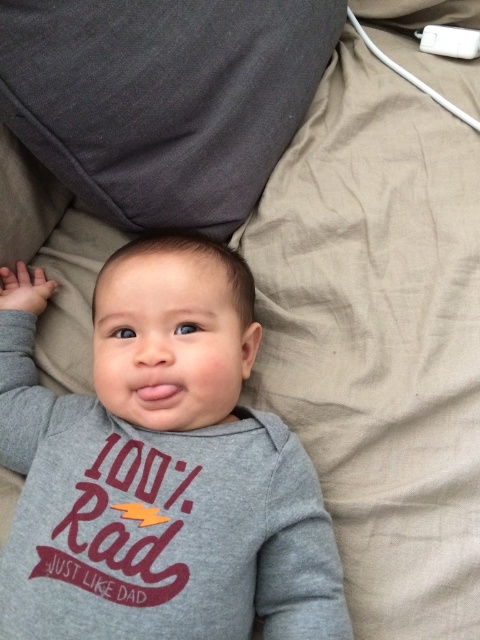
You are a parent trying to locate your baby monitor. The dark gray fabric pillow at upper center and the white plastic remote at upper right are in the scene. Which object is closer to the top of the image?

The white plastic remote at upper right is closer to the top of the image because the dark gray fabric pillow at upper center is below it.

You are a photographer setting up for a baby photo shoot. You have a gray soft fabric baby at center and a dark gray fabric pillow at upper center in the scene. Which object should you focus on first if you want to highlight the larger one?

The gray soft fabric baby at center is larger in size than the dark gray fabric pillow at upper center, so you should focus on the gray soft fabric baby at center first.

You are a parent trying to hand your baby the white plastic remote at upper right. The dark gray fabric pillow at upper center is in the way. Can you move the pillow to the side to reach the remote?

The dark gray fabric pillow at upper center is 17.89 inches away from the white plastic remote at upper right, so yes, you can move the pillow to the side to reach the remote since there is enough space between them.